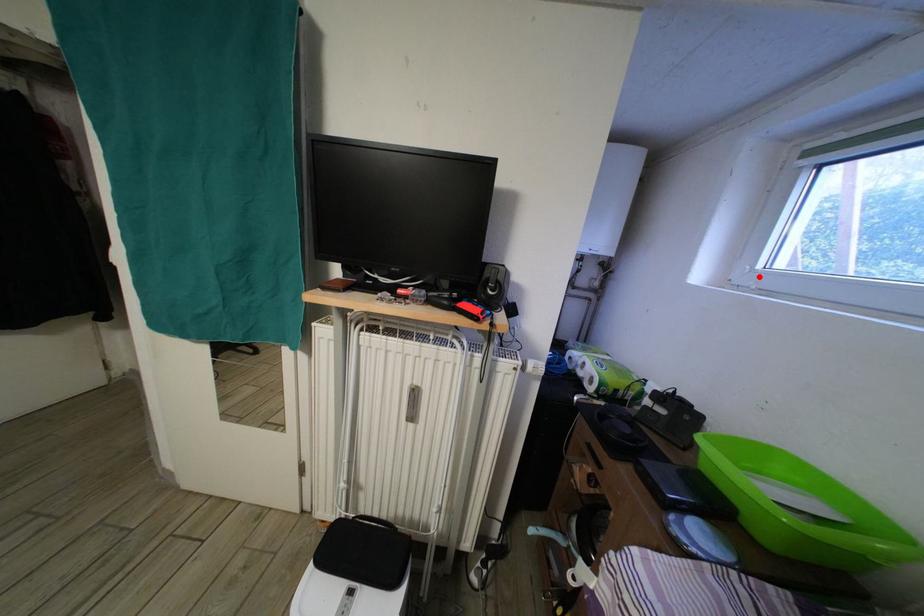
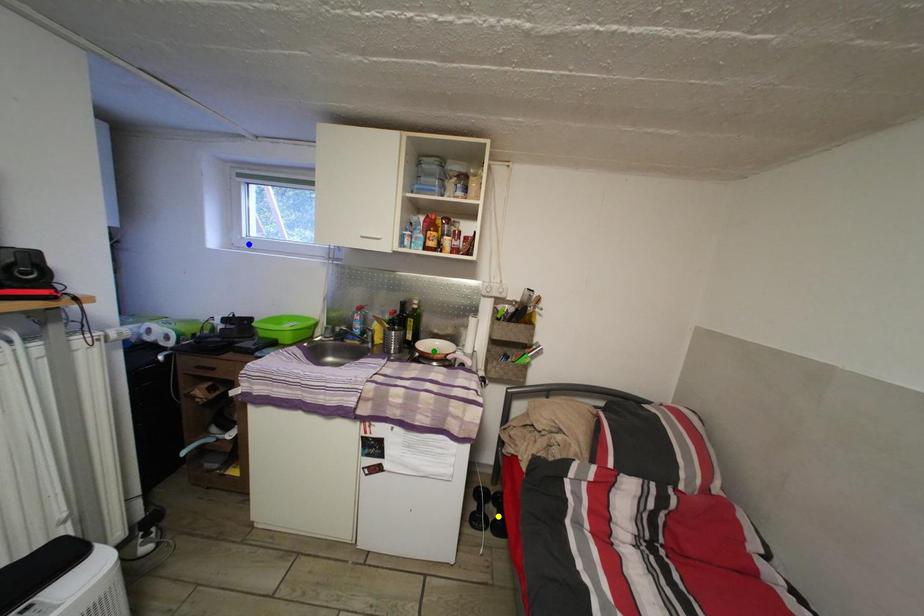
Question: I am providing you with two images of the same scene from different viewpoints. A red point is marked on the first image. You are given multiple points on the second image. Which point in image 2 is actually the same real-world point as the red point in image 1?

Choices:
 (A) green point
 (B) yellow point
 (C) blue point

Answer: (C)